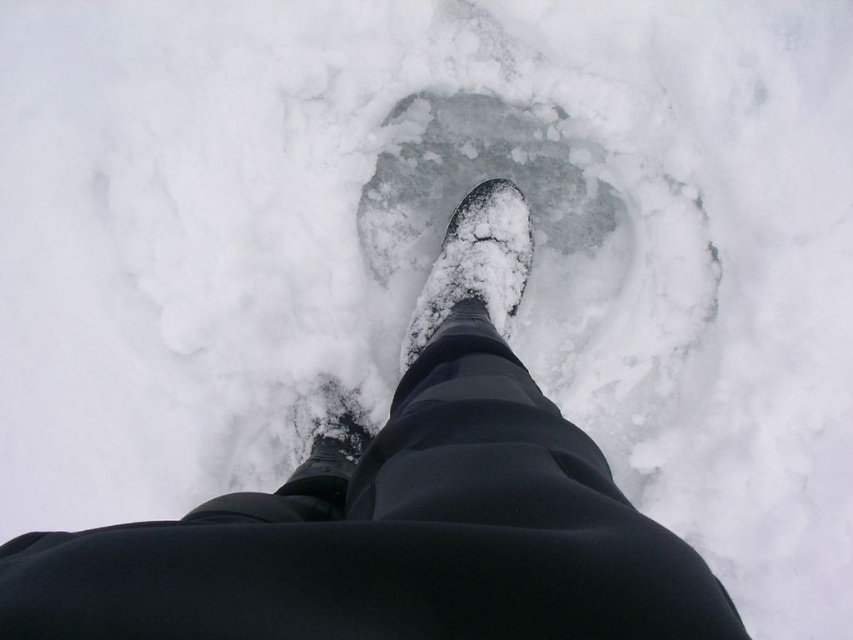
Between point (477, 232) and point (282, 492), which one is positioned behind?

Point (477, 232)

Is point (523, 237) farther from camera compared to point (339, 436)?

That is True.

Identify the location of snow-covered boot at center. (476, 264).

Between shiny black boot at center and matte black boot at lower center, which one is positioned lower?

matte black boot at lower center

Is point (260, 566) closer to viewer compared to point (305, 492)?

Yes, it is.

The image size is (853, 640). Find the location of `shiny black boot at center`. shiny black boot at center is located at coordinates (401, 513).

Measure the distance between shiny black boot at center and camera.

shiny black boot at center and camera are 18.08 inches apart from each other.

The width and height of the screenshot is (853, 640). What do you see at coordinates (401, 513) in the screenshot?
I see `shiny black boot at center` at bounding box center [401, 513].

Which is in front, point (457, 304) or point (514, 220)?

Point (457, 304) is in front.

I want to click on shiny black boot at center, so click(401, 513).